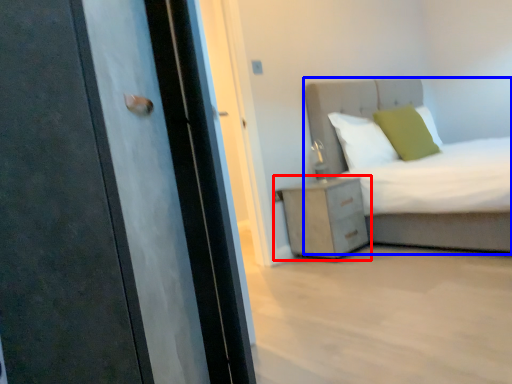
Question: Which object appears closest to the camera in this image, nightstand (highlighted by a red box) or bed (highlighted by a blue box)?

Choices:
 (A) nightstand
 (B) bed

Answer: (B)